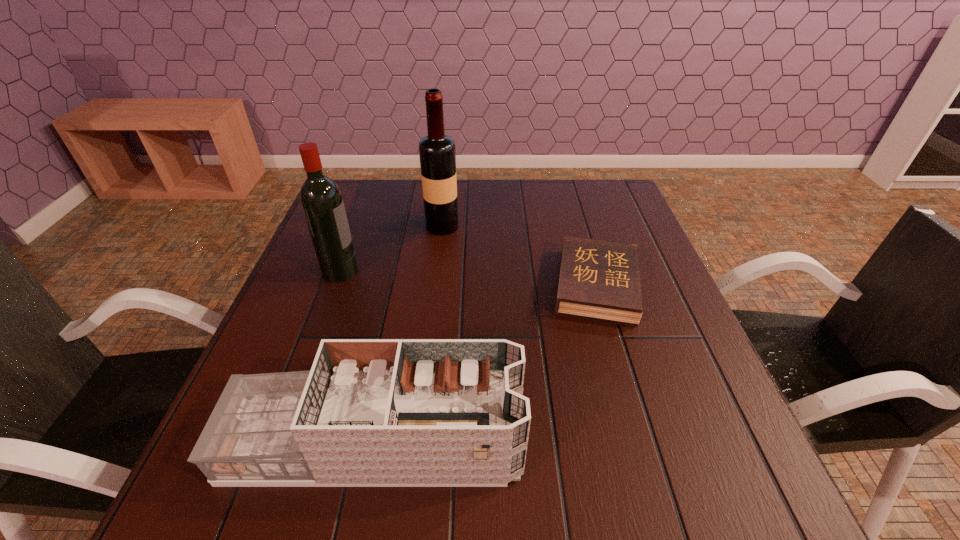
Locate an element on the screen. the right wine bottle is located at coordinates pos(437,152).

The width and height of the screenshot is (960, 540). Find the location of `the farther wine bottle`. the farther wine bottle is located at coordinates [x=437, y=152].

Where is `the nearer wine bottle`? the nearer wine bottle is located at coordinates (321, 199).

The width and height of the screenshot is (960, 540). Identify the location of the nearest object. (371, 412).

Where is `dollhouse`? This screenshot has height=540, width=960. dollhouse is located at coordinates (371, 412).

I want to click on the rightmost object, so click(600, 279).

Identify the location of hardback book. (600, 279).

At what (x,y) coordinates should I click in order to perform the action: click on vacant space located 0.130m on the right of the farther wine bottle. Please return your answer as a coordinate pair (x, y). Looking at the image, I should click on (504, 226).

What are the coordinates of `free region located on the label of the nearer wine bottle` in the screenshot? It's located at (390, 271).

Find the location of a particular element. free space located 0.300m at the entrance of the nearest object is located at coordinates (694, 443).